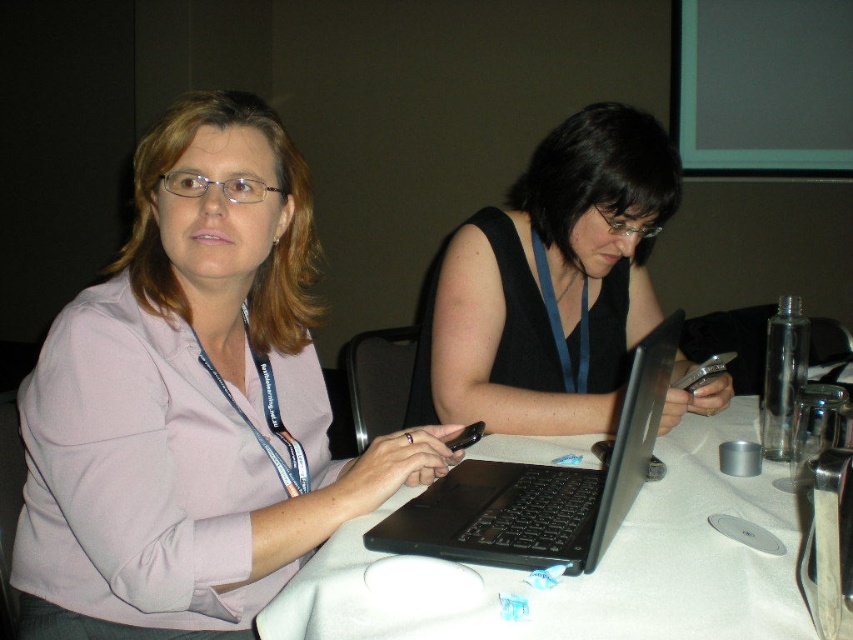
What do you see at coordinates (190, 403) in the screenshot? I see `matte pink shirt at center` at bounding box center [190, 403].

Measure the distance between point [276,301] and camera.

Point [276,301] and camera are 3.77 feet apart.

Where is `matte pink shirt at center`? The height and width of the screenshot is (640, 853). matte pink shirt at center is located at coordinates (190, 403).

Does matte pink shirt at center have a larger size compared to black matte laptop at center?

Yes, matte pink shirt at center is bigger than black matte laptop at center.

Who is lower down, matte pink shirt at center or black matte laptop at center?

black matte laptop at center

The height and width of the screenshot is (640, 853). Find the location of `matte pink shirt at center`. matte pink shirt at center is located at coordinates (190, 403).

Does point (305, 524) lie behind point (666, 484)?

No, it is not.

Is matte pink shirt at center bigger than white cloth table at center?

Indeed, matte pink shirt at center has a larger size compared to white cloth table at center.

Identify the location of matte pink shirt at center. (190, 403).

Locate an element on the screen. This screenshot has width=853, height=640. matte pink shirt at center is located at coordinates (190, 403).